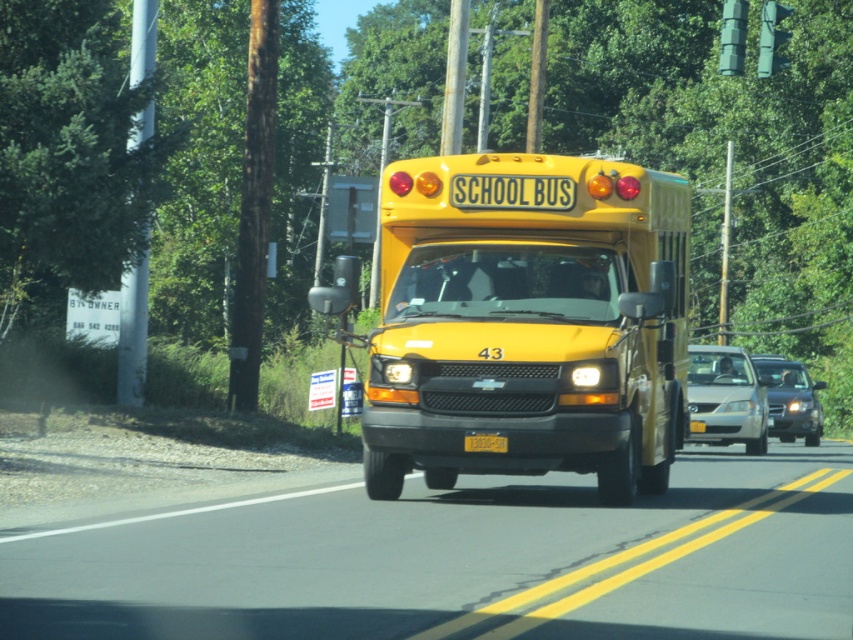
Question: Which object is the farthest from the silver metallic sedan at center?

Choices:
 (A) yellow matte school bus at center
 (B) yellow matte license plate at center

Answer: (B)

Question: Where is yellow matte school bus at center located in relation to silver metallic sedan at center in the image?

Choices:
 (A) above
 (B) below

Answer: (A)

Question: Is shiny black sedan at center below yellow matte license plate at center?

Choices:
 (A) yes
 (B) no

Answer: (A)

Question: Can you confirm if silver metallic sedan at center is positioned above shiny black sedan at center?

Choices:
 (A) no
 (B) yes

Answer: (B)

Question: Which object is closer to the camera taking this photo?

Choices:
 (A) yellow matte license plate at center
 (B) silver metallic sedan at center
 (C) yellow matte school bus at center

Answer: (C)

Question: Which object appears farthest from the camera in this image?

Choices:
 (A) shiny black sedan at center
 (B) silver metallic sedan at center
 (C) yellow matte license plate at center
 (D) yellow matte school bus at center

Answer: (A)